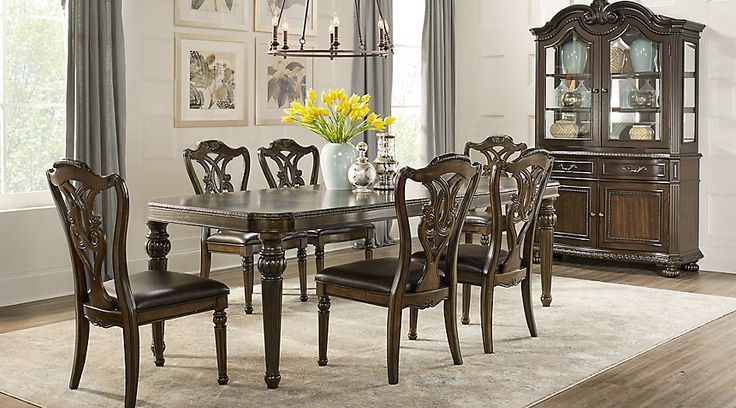
Locate an element on the screen. The image size is (736, 408). pictures is located at coordinates (219, 71), (286, 73), (222, 6), (294, 7).